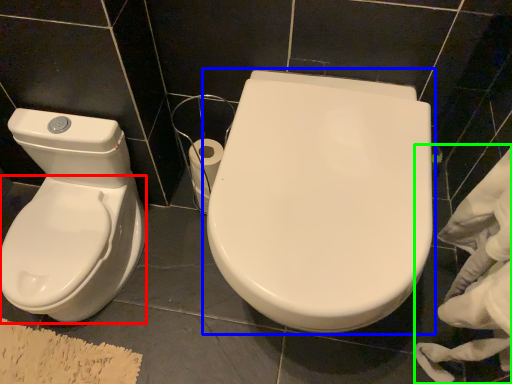
Question: Estimate the real-world distances between objects in this image. Which object is closer to bidet (highlighted by a red box), toilet (highlighted by a blue box) or material (highlighted by a green box)?

Choices:
 (A) toilet
 (B) material

Answer: (A)